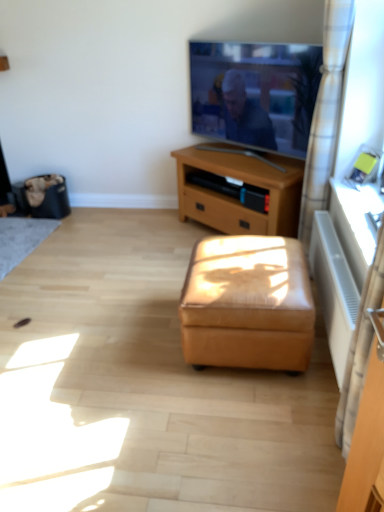
Question: Can you confirm if matte black tv at upper center is wider than black fabric trash bin at left?

Choices:
 (A) no
 (B) yes

Answer: (A)

Question: Is the depth of matte black tv at upper center greater than that of black fabric trash bin at left?

Choices:
 (A) yes
 (B) no

Answer: (B)

Question: From the image's perspective, is matte black tv at upper center above black fabric trash bin at left?

Choices:
 (A) yes
 (B) no

Answer: (A)

Question: Is matte black tv at upper center positioned before black fabric trash bin at left?

Choices:
 (A) no
 (B) yes

Answer: (B)

Question: Can you confirm if matte black tv at upper center is shorter than black fabric trash bin at left?

Choices:
 (A) yes
 (B) no

Answer: (B)

Question: Would you say matte black tv at upper center is inside or outside black fabric trash bin at left?

Choices:
 (A) inside
 (B) outside

Answer: (B)

Question: Does point (218, 132) appear closer or farther from the camera than point (31, 209)?

Choices:
 (A) farther
 (B) closer

Answer: (B)

Question: Relative to black fabric trash bin at left, is matte black tv at upper center in front or behind?

Choices:
 (A) front
 (B) behind

Answer: (A)

Question: From the image's perspective, is matte black tv at upper center positioned above or below black fabric trash bin at left?

Choices:
 (A) below
 (B) above

Answer: (B)

Question: From the image's perspective, is metallic silver radiator at right located above or below black fabric trash bin at left?

Choices:
 (A) above
 (B) below

Answer: (B)

Question: Is metallic silver radiator at right wider or thinner than black fabric trash bin at left?

Choices:
 (A) thin
 (B) wide

Answer: (A)

Question: In the image, is metallic silver radiator at right positioned in front of or behind black fabric trash bin at left?

Choices:
 (A) behind
 (B) front

Answer: (B)

Question: Considering the positions of metallic silver radiator at right and black fabric trash bin at left in the image, is metallic silver radiator at right taller or shorter than black fabric trash bin at left?

Choices:
 (A) short
 (B) tall

Answer: (A)

Question: Is black fabric trash bin at left spatially inside leather ottoman at center, or outside of it?

Choices:
 (A) outside
 (B) inside

Answer: (A)

Question: From a real-world perspective, is black fabric trash bin at left above or below leather ottoman at center?

Choices:
 (A) above
 (B) below

Answer: (B)